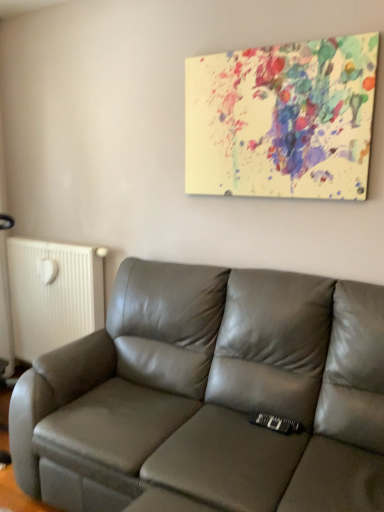
Question: Would you say satin gray leather couch at center is inside or outside paint splatter canvas at upper center?

Choices:
 (A) outside
 (B) inside

Answer: (A)

Question: In the image, is satin gray leather couch at center on the left side or the right side of paint splatter canvas at upper center?

Choices:
 (A) right
 (B) left

Answer: (B)

Question: Estimate the real-world distances between objects in this image. Which object is closer to the white matte radiator at left?

Choices:
 (A) paint splatter canvas at upper center
 (B) satin gray leather couch at center

Answer: (B)

Question: Which of these objects is positioned closest to the white matte radiator at left?

Choices:
 (A) paint splatter canvas at upper center
 (B) satin gray leather couch at center

Answer: (B)